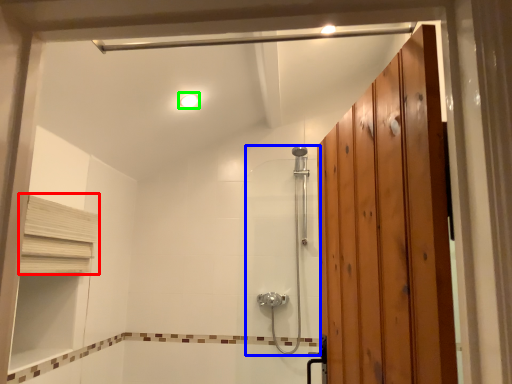
Question: Based on their relative distances, which object is farther from shelf (highlighted by a red box)? Choose from shower door (highlighted by a blue box) and light fixture (highlighted by a green box).

Choices:
 (A) shower door
 (B) light fixture

Answer: (A)